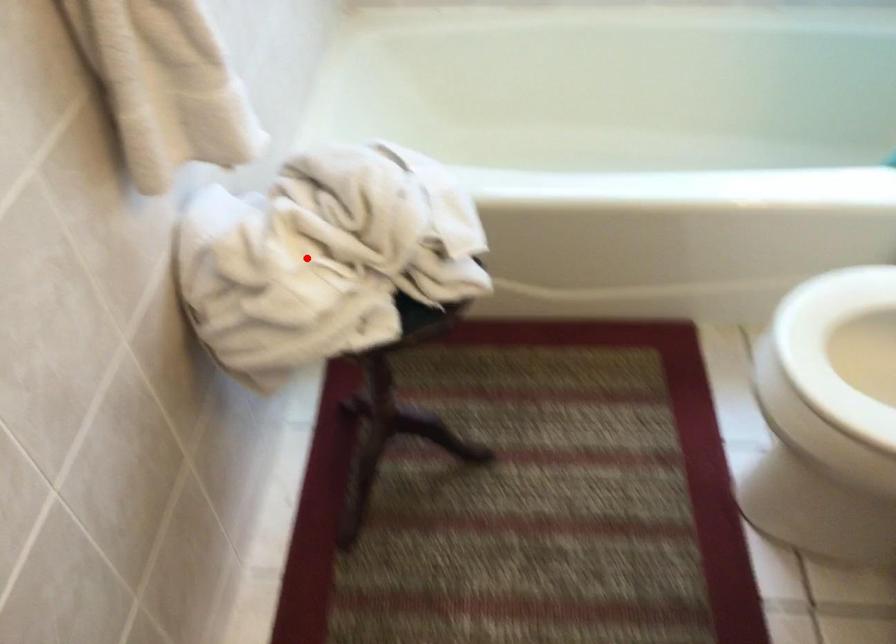
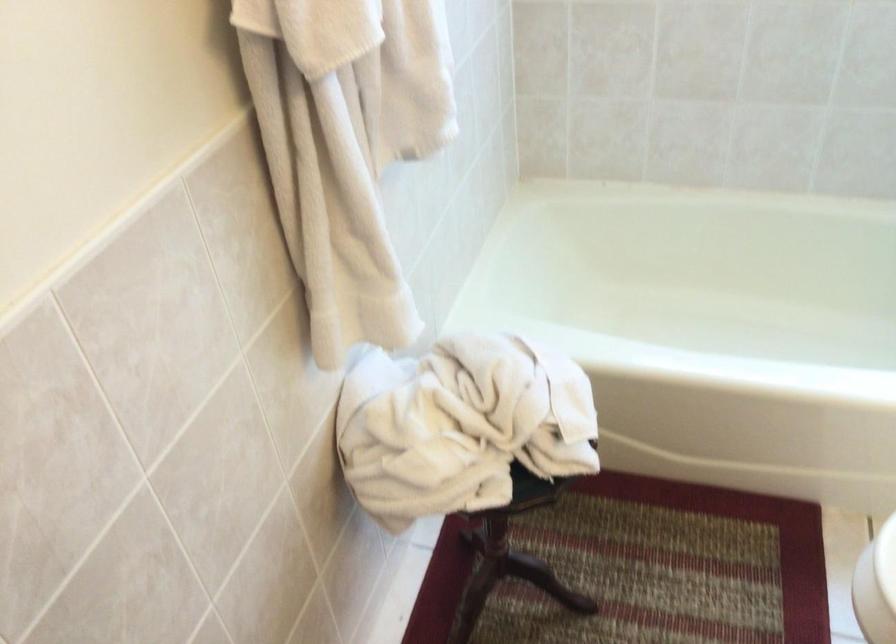
Question: I am providing you with two images of the same scene from different viewpoints. Image1 has a red point marked. In image2, the corresponding 3D location appears at what relative position? Reply with the corresponding letter.

Choices:
 (A) Closer
 (B) Farther

Answer: (B)